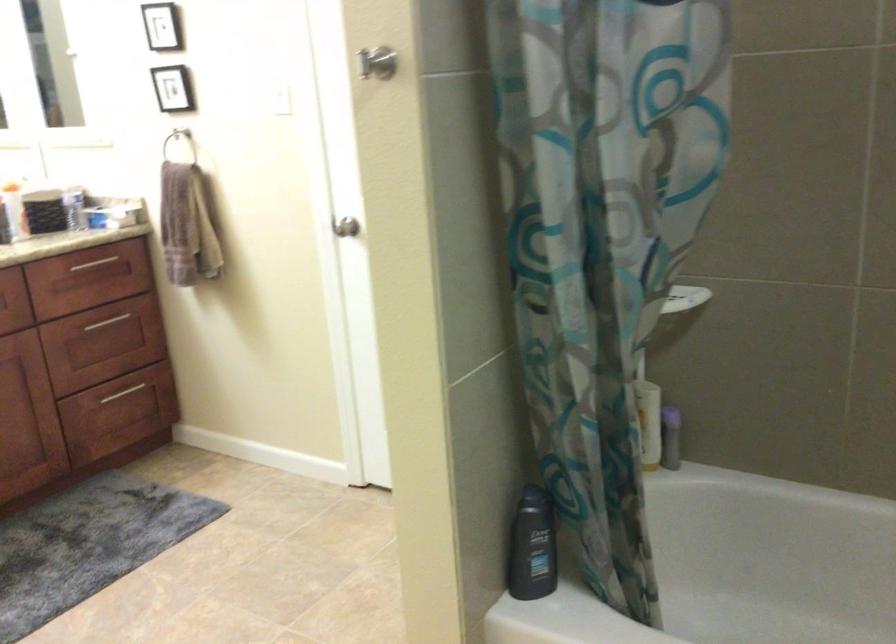
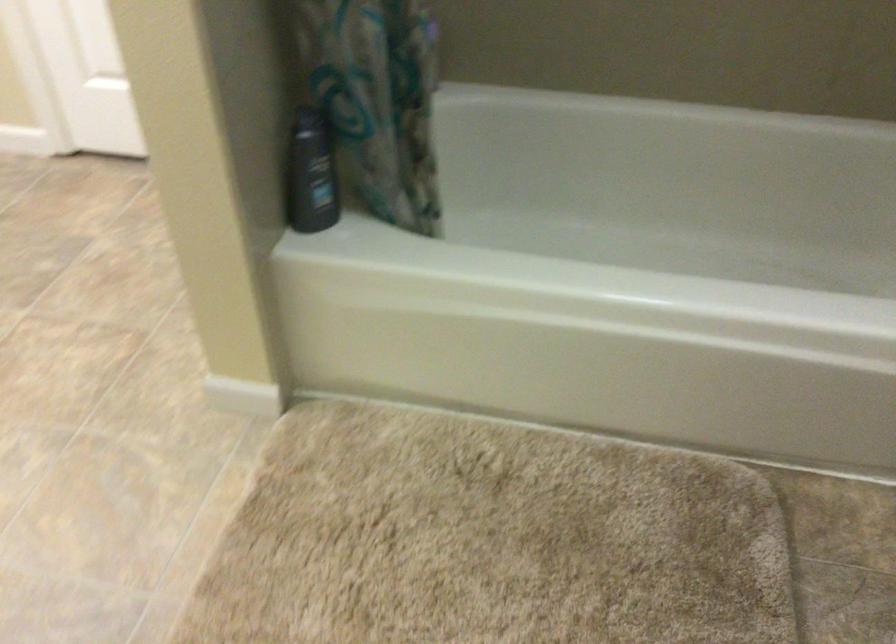
Find the pixel in the second image that matches [529,544] in the first image.

(311, 174)